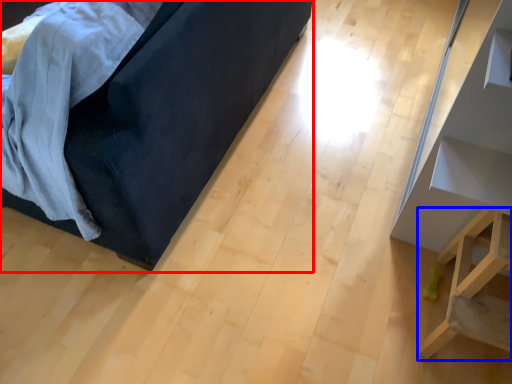
Question: Among these objects, which one is nearest to the camera, furniture (highlighted by a red box) or furniture (highlighted by a blue box)?

Choices:
 (A) furniture
 (B) furniture

Answer: (A)